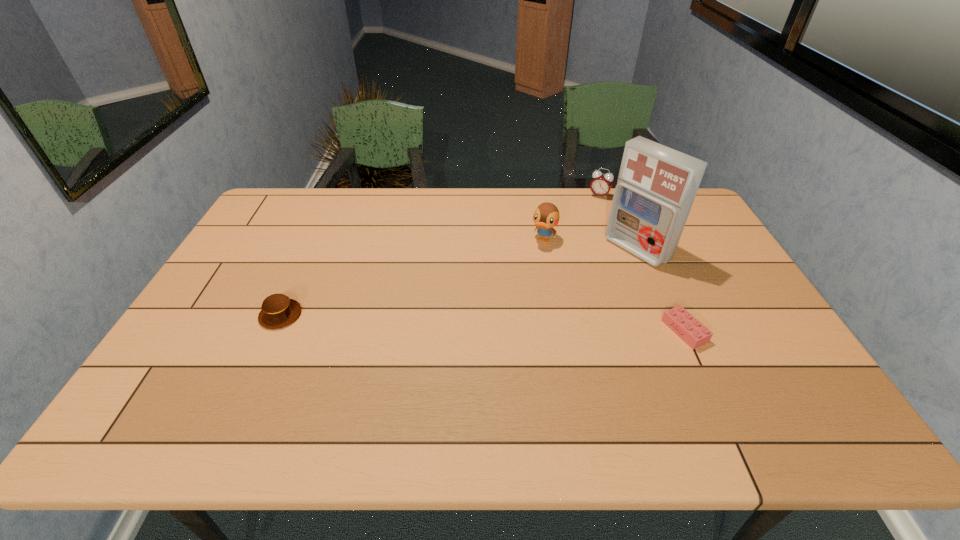
Identify the location of blank space at the far edge. The height and width of the screenshot is (540, 960). (575, 221).

In the image, there is a desktop. Find the location of `vacant space at the near edge`. vacant space at the near edge is located at coordinates (720, 383).

Find the location of a particular element. vacant space at the right edge is located at coordinates (698, 257).

In the image, there is a desktop. Where is `vacant space at the far left corner`? Image resolution: width=960 pixels, height=540 pixels. vacant space at the far left corner is located at coordinates (288, 206).

In the image, there is a desktop. Identify the location of free space at the near right corner. The width and height of the screenshot is (960, 540). (770, 381).

Image resolution: width=960 pixels, height=540 pixels. Find the location of `empty space that is in between the tallest object and the fourth object from right to left`. empty space that is in between the tallest object and the fourth object from right to left is located at coordinates (590, 245).

Identify the location of vacant point located between the leftmost object and the Lego. [x=483, y=323].

Where is `blank region between the first-aid kit and the fourth tallest object`? blank region between the first-aid kit and the fourth tallest object is located at coordinates (x=459, y=282).

In order to click on free space between the duck and the first-aid kit in this screenshot , I will do `click(590, 245)`.

The width and height of the screenshot is (960, 540). Identify the location of vacant space in between the tallest object and the Lego. (660, 291).